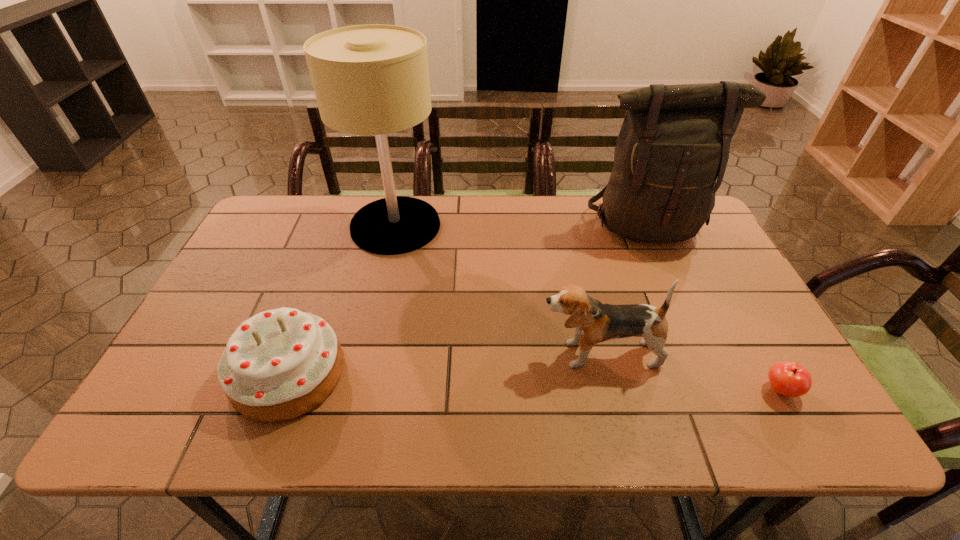
You are a GUI agent. You are given a task and a screenshot of the screen. Output one action in this format:
    pyautogui.click(x=<x>, y=<y>)
    Task: Click on the free spot located on the right of the second shortest object
    Image resolution: width=960 pixels, height=540 pixels.
    Given the screenshot: What is the action you would take?
    pyautogui.click(x=504, y=374)

The height and width of the screenshot is (540, 960). In order to click on vacant area situated 0.200m on the left of the apple in this screenshot , I will do (673, 390).

Locate an element on the screen. This screenshot has width=960, height=540. table lamp situated at the far edge is located at coordinates (373, 79).

Identify the location of backpack present at the far edge. (674, 142).

The width and height of the screenshot is (960, 540). In order to click on cake situated at the near edge in this screenshot , I will do `click(279, 364)`.

The height and width of the screenshot is (540, 960). What are the coordinates of `apple that is at the near edge` in the screenshot? It's located at (788, 378).

You are a GUI agent. You are given a task and a screenshot of the screen. Output one action in this format:
    pyautogui.click(x=<x>, y=<y>)
    Task: Click on the object located in the left edge section of the desktop
    Image resolution: width=960 pixels, height=540 pixels.
    Given the screenshot: What is the action you would take?
    pyautogui.click(x=279, y=364)

Locate an element on the screen. backpack at the right edge is located at coordinates (674, 142).

The height and width of the screenshot is (540, 960). In order to click on apple that is at the right edge in this screenshot , I will do `click(788, 378)`.

Locate an element on the screen. object that is at the near left corner is located at coordinates (279, 364).